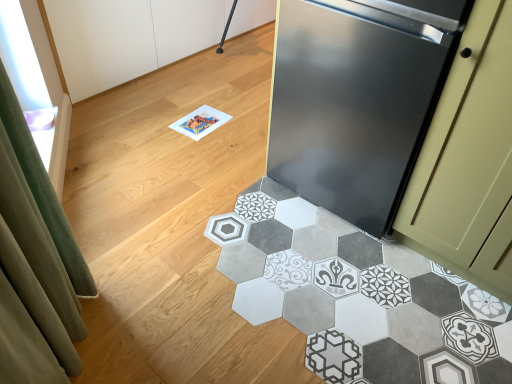
What is the approximate height of patterned tile floor at lower right?

patterned tile floor at lower right is 1.49 inches tall.

Describe the element at coordinates (358, 296) in the screenshot. The width and height of the screenshot is (512, 384). I see `patterned tile floor at lower right` at that location.

I want to click on patterned tile floor at lower right, so click(x=358, y=296).

The height and width of the screenshot is (384, 512). What do you see at coordinates (358, 99) in the screenshot? I see `stainless steel refrigerator at right` at bounding box center [358, 99].

Find the location of a particular element. stainless steel refrigerator at right is located at coordinates (358, 99).

I want to click on patterned tile floor at lower right, so click(x=358, y=296).

Which is more to the right, patterned tile floor at lower right or stainless steel refrigerator at right?

From the viewer's perspective, stainless steel refrigerator at right appears more on the right side.

Between patterned tile floor at lower right and stainless steel refrigerator at right, which one is positioned behind?

stainless steel refrigerator at right.

Does point (271, 192) appear closer or farther from the camera than point (343, 122)?

Point (271, 192).

From the image's perspective, between patterned tile floor at lower right and stainless steel refrigerator at right, who is located below?

patterned tile floor at lower right, from the image's perspective.

From the picture: From a real-world perspective, is patterned tile floor at lower right physically located above or below stainless steel refrigerator at right?

From a real-world perspective, patterned tile floor at lower right is physically below stainless steel refrigerator at right.

Which of these two, patterned tile floor at lower right or stainless steel refrigerator at right, is wider?

Wider between the two is patterned tile floor at lower right.

Is patterned tile floor at lower right taller or shorter than stainless steel refrigerator at right?

Considering their sizes, patterned tile floor at lower right has less height than stainless steel refrigerator at right.

Considering the relative sizes of patterned tile floor at lower right and stainless steel refrigerator at right in the image provided, is patterned tile floor at lower right bigger than stainless steel refrigerator at right?

No, patterned tile floor at lower right is not bigger than stainless steel refrigerator at right.

Is patterned tile floor at lower right surrounding stainless steel refrigerator at right?

No, stainless steel refrigerator at right is not a part of patterned tile floor at lower right.

Is patterned tile floor at lower right touching stainless steel refrigerator at right?

patterned tile floor at lower right and stainless steel refrigerator at right are not in contact.

Is patterned tile floor at lower right oriented away from stainless steel refrigerator at right?

No.

How different are the orientations of patterned tile floor at lower right and stainless steel refrigerator at right in degrees?

They differ by 0.0867 degrees in their facing directions.

How distant is patterned tile floor at lower right from stainless steel refrigerator at right?

They are 16.53 inches apart.

Image resolution: width=512 pixels, height=384 pixels. Identify the location of refrigerator above the patterned tile floor at lower right (from a real-world perspective). (358, 99).

Can you confirm if stainless steel refrigerator at right is positioned to the right of patterned tile floor at lower right?

Correct, you'll find stainless steel refrigerator at right to the right of patterned tile floor at lower right.

Between stainless steel refrigerator at right and patterned tile floor at lower right, which one is positioned in front?

Positioned in front is patterned tile floor at lower right.

Which point is more forward, (313, 129) or (483, 298)?

The point (483, 298) is more forward.

From the image's perspective, is stainless steel refrigerator at right under patterned tile floor at lower right?

No.

From a real-world perspective, is stainless steel refrigerator at right physically located above or below patterned tile floor at lower right?

stainless steel refrigerator at right is situated higher than patterned tile floor at lower right in the real world.

Looking at their sizes, would you say stainless steel refrigerator at right is wider or thinner than patterned tile floor at lower right?

Considering their sizes, stainless steel refrigerator at right looks slimmer than patterned tile floor at lower right.

Does stainless steel refrigerator at right have a greater height compared to patterned tile floor at lower right?

Yes.

Which of these two, stainless steel refrigerator at right or patterned tile floor at lower right, is smaller?

Smaller between the two is patterned tile floor at lower right.

Can patterned tile floor at lower right be found inside stainless steel refrigerator at right?

No, patterned tile floor at lower right is not inside stainless steel refrigerator at right.

From the picture: Is stainless steel refrigerator at right with patterned tile floor at lower right?

No, stainless steel refrigerator at right is not touching patterned tile floor at lower right.

Is stainless steel refrigerator at right turned away from patterned tile floor at lower right?

No.

The image size is (512, 384). In order to click on marble below the stainless steel refrigerator at right (from the image's perspective) in this screenshot , I will do `click(358, 296)`.

The width and height of the screenshot is (512, 384). In order to click on refrigerator located behind the patterned tile floor at lower right in this screenshot , I will do `click(358, 99)`.

Identify the location of marble that appears below the stainless steel refrigerator at right (from the image's perspective). (358, 296).